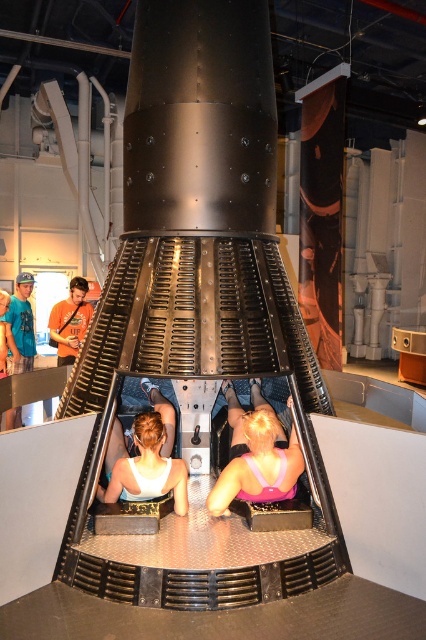
You are an event planner setting up a photo booth area in the museum. You need to ensure that both the pink fabric at center and the white matte tank top at center are visible in the photos. Based on their positions, which object should be moved forward to ensure both are visible?

The white matte tank top at center is behind the pink fabric at center, so moving the white matte tank top at center forward would ensure both objects are visible in the photos.

You are standing in the museum and see the point marked at coordinates (256, 454). What is the color of the fabric at that point?

The point at coordinates (256, 454) is on pink fabric at center.

You are an AI system that needs to locate the pink fabric at center in the image. What are its coordinates?

The pink fabric at center is located at coordinates point (256, 454).